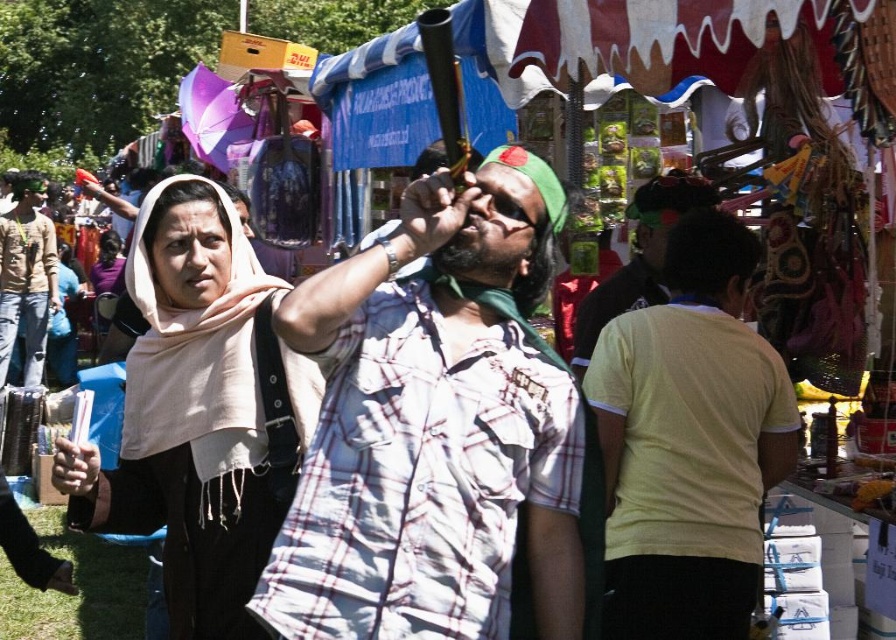
Which of these two, white checkered shirt at center or light brown cotton shirt at left, stands taller?

light brown cotton shirt at left is taller.

Can you confirm if white checkered shirt at center is thinner than light brown cotton shirt at left?

No, white checkered shirt at center is not thinner than light brown cotton shirt at left.

Is point (513, 262) farther from viewer compared to point (50, 292)?

No, (513, 262) is closer to viewer.

Identify the location of white checkered shirt at center. (435, 426).

How distant is yellow cotton t-shirt at center from light brown cotton shirt at left?

yellow cotton t-shirt at center is 9.19 meters away from light brown cotton shirt at left.

Is point (602, 380) closer to viewer compared to point (28, 348)?

Yes, it is in front of point (28, 348).

Which is behind, point (695, 480) or point (45, 336)?

Positioned behind is point (45, 336).

Where is `yellow cotton t-shirt at center`? yellow cotton t-shirt at center is located at coordinates (688, 442).

Can you confirm if white checkered shirt at center is positioned below yellow cotton t-shirt at center?

No, white checkered shirt at center is not below yellow cotton t-shirt at center.

Who is more distant from viewer, (472,392) or (688,384)?

The point (688,384) is more distant.

Is point (496, 467) closer to viewer compared to point (747, 474)?

That is True.

I want to click on white checkered shirt at center, so click(435, 426).